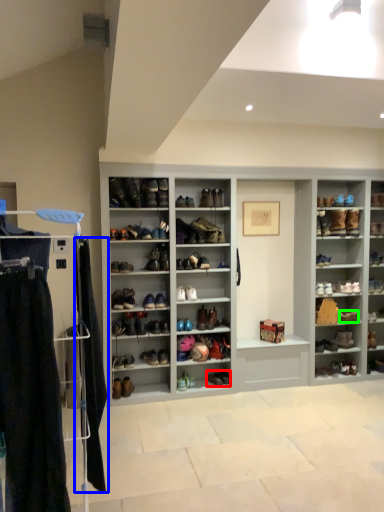
Question: Which object is the closest to the footwear (highlighted by a red box)? Choose among these: clothing (highlighted by a blue box) or shoe (highlighted by a green box).

Choices:
 (A) clothing
 (B) shoe

Answer: (B)